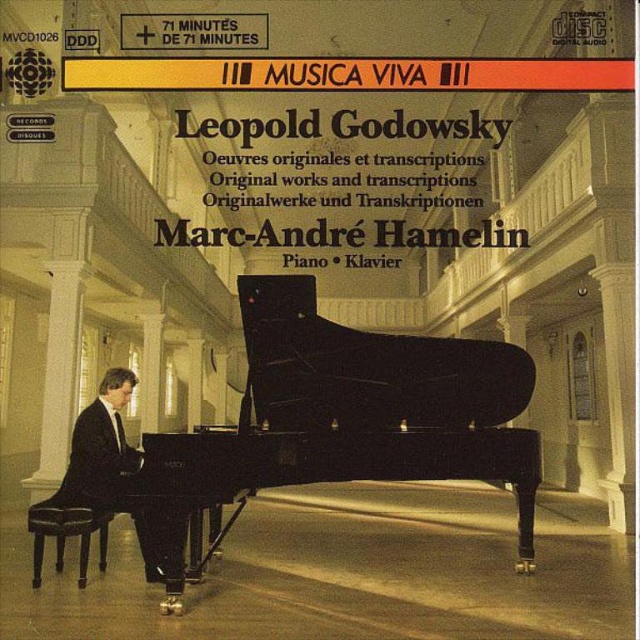
You are attending a classical music concert in the grand hall depicted in the image. You see the black polished piano at center and the black suit at left. From your perspective, which object is positioned to the right of the other?

The black polished piano at center is to the right of the black suit at left.